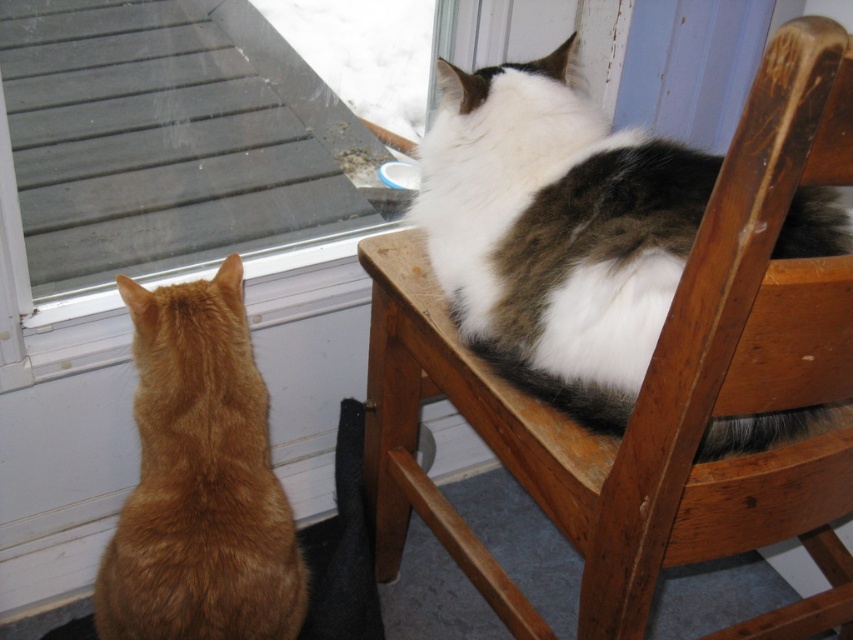
Question: Which of the following is the closest to the observer?

Choices:
 (A) (751, 138)
 (B) (149, 305)

Answer: (A)

Question: Is wooden chair at upper right above orange fur cat at left?

Choices:
 (A) no
 (B) yes

Answer: (B)

Question: Which point appears farthest from the camera in this image?

Choices:
 (A) (850, 292)
 (B) (256, 492)

Answer: (B)

Question: Does wooden chair at upper right have a greater width compared to orange fur cat at left?

Choices:
 (A) yes
 (B) no

Answer: (A)

Question: Observing the image, what is the correct spatial positioning of wooden chair at upper right in reference to orange fur cat at left?

Choices:
 (A) below
 (B) above

Answer: (B)

Question: Which point appears closest to the camera in this image?

Choices:
 (A) (125, 524)
 (B) (817, 340)

Answer: (B)